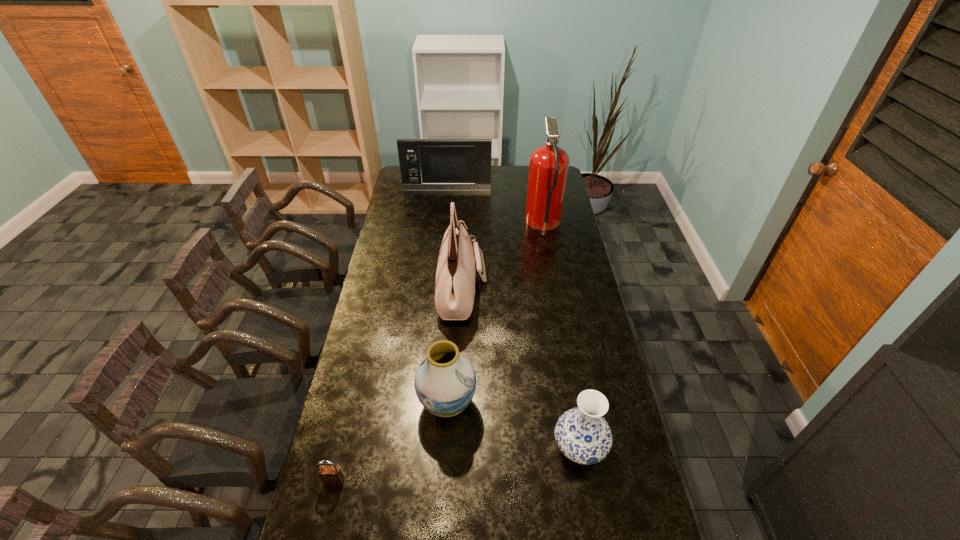
Identify the location of vacant space located on the side of the third farthest object with the attached pouch. (506, 292).

Locate an element on the screen. The width and height of the screenshot is (960, 540). free space located on the front panel of the microwave oven is located at coordinates tap(444, 215).

You are a GUI agent. You are given a task and a screenshot of the screen. Output one action in this format:
    pyautogui.click(x=<x>, y=<y>)
    Task: Click on the blank space located 0.130m on the right of the left vase
    Image resolution: width=960 pixels, height=540 pixels.
    Given the screenshot: What is the action you would take?
    pyautogui.click(x=516, y=403)

Locate an element on the screen. This screenshot has width=960, height=540. vacant point located on the back of the right vase is located at coordinates (564, 363).

The height and width of the screenshot is (540, 960). I want to click on free space located on the front-facing side of the nearest object, so click(x=325, y=518).

The image size is (960, 540). Find the location of `microwave oven situated at the left edge`. microwave oven situated at the left edge is located at coordinates (426, 164).

Where is `padlock that is at the left edge`? The image size is (960, 540). padlock that is at the left edge is located at coordinates click(x=332, y=474).

Where is `fire extinguisher that is positioned at the right edge`? The image size is (960, 540). fire extinguisher that is positioned at the right edge is located at coordinates (549, 164).

I want to click on vase that is at the right edge, so click(582, 434).

At what (x,y) coordinates should I click in order to perform the action: click on vacant space at the far edge of the desktop. Please return your answer as a coordinate pair (x, y). This screenshot has width=960, height=540. Looking at the image, I should click on (516, 184).